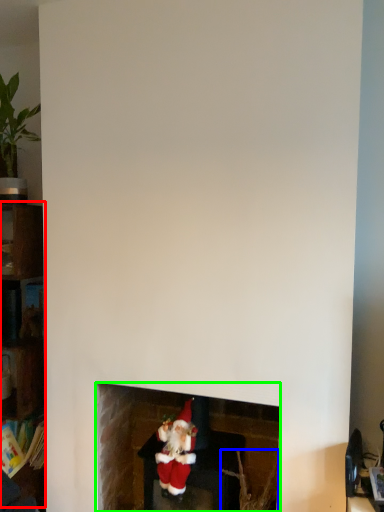
Question: Which object is positioned closest to shelf (highlighted by a red box)? Select from plant (highlighted by a blue box) and fireplace (highlighted by a green box).

Choices:
 (A) plant
 (B) fireplace

Answer: (B)